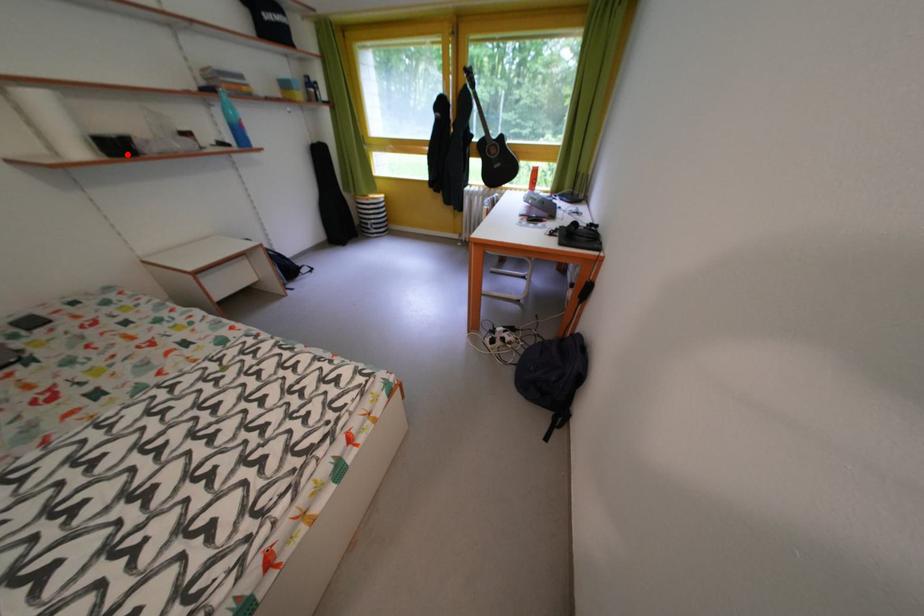
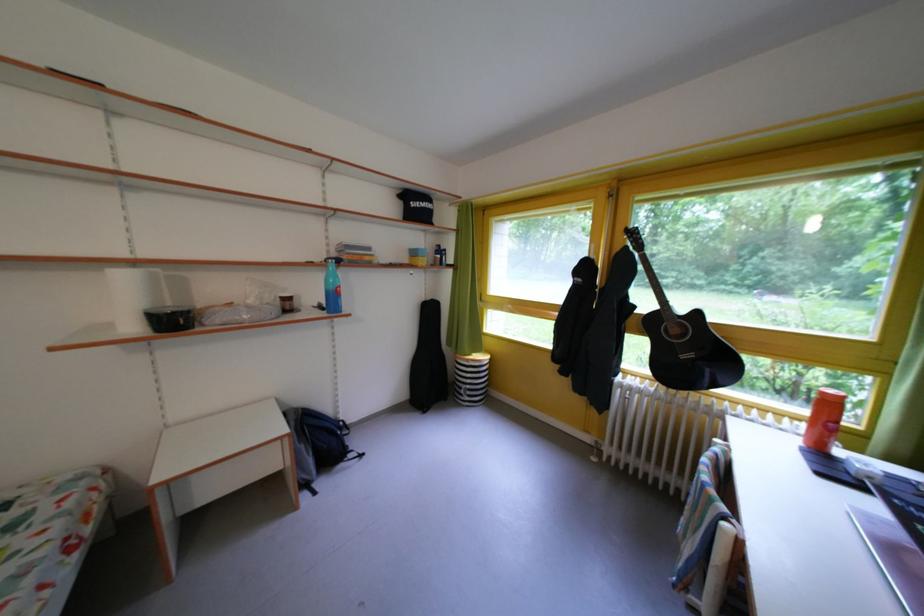
Where in the second image is the point corresponding to the highlighted location from the first image?

(184, 328)